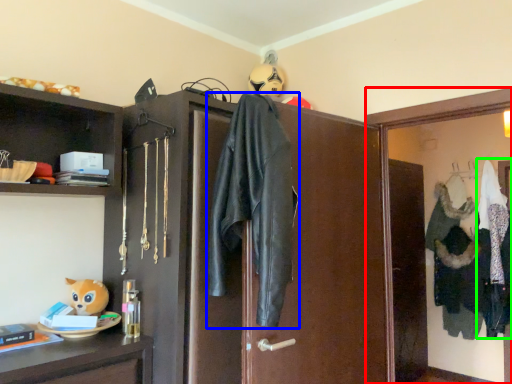
Question: Estimate the real-world distances between objects in this image. Which object is closer to medicine cabinet (highlighted by a red box), jacket (highlighted by a blue box) or clothing (highlighted by a green box)?

Choices:
 (A) jacket
 (B) clothing

Answer: (A)